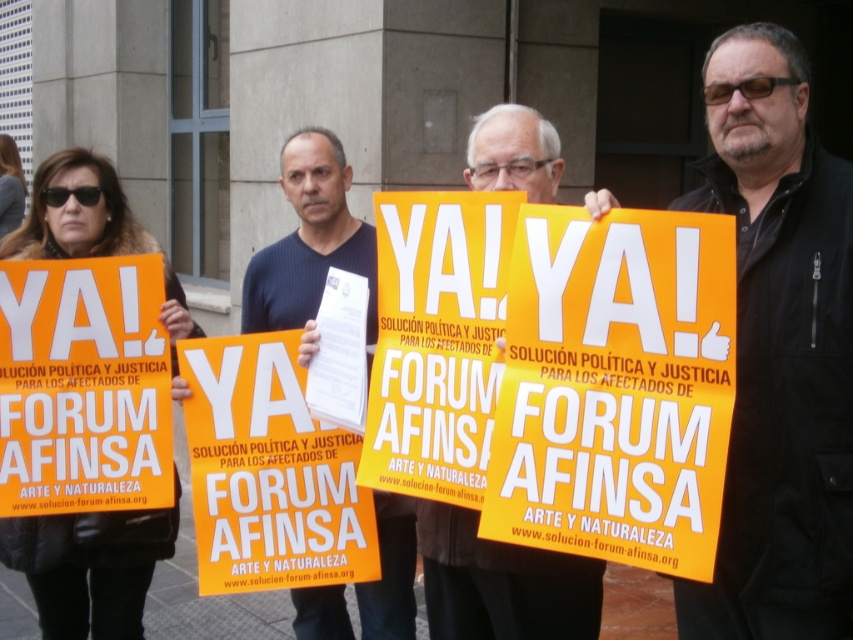
Question: Which point is farther from the camera taking this photo?

Choices:
 (A) (772, 364)
 (B) (244, 406)

Answer: (B)

Question: Does matte black jacket at center have a smaller size compared to dark blue shirt at center?

Choices:
 (A) no
 (B) yes

Answer: (A)

Question: Which object is the closest to the orange matte sign at center?

Choices:
 (A) matte yellow sign at center
 (B) dark blue shirt at center

Answer: (A)

Question: Which point is farther from the camera taking this photo?

Choices:
 (A) (21, 321)
 (B) (451, 563)

Answer: (A)

Question: Is orange matte sign at center further to camera compared to matte black jacket at center?

Choices:
 (A) yes
 (B) no

Answer: (B)

Question: Is matte black jacket at center further to the viewer compared to orange matte sign at left?

Choices:
 (A) no
 (B) yes

Answer: (A)